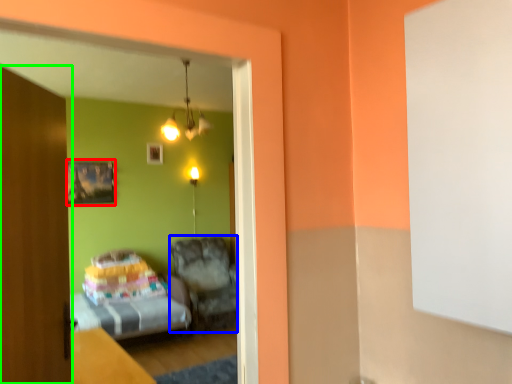
Question: Considering the real-world distances, which object is closest to picture frame (highlighted by a red box)? furniture (highlighted by a blue box) or door (highlighted by a green box).

Choices:
 (A) furniture
 (B) door

Answer: (A)